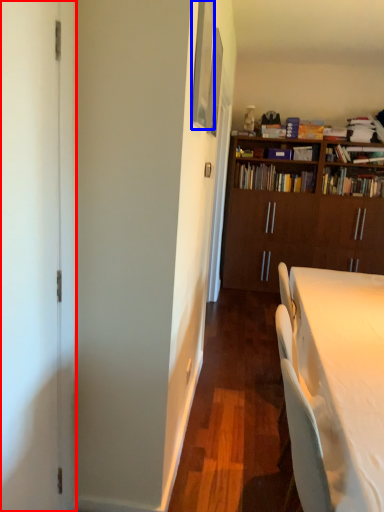
Question: Which object appears farthest to the camera in this image, screen door (highlighted by a red box) or picture frame (highlighted by a blue box)?

Choices:
 (A) screen door
 (B) picture frame

Answer: (B)